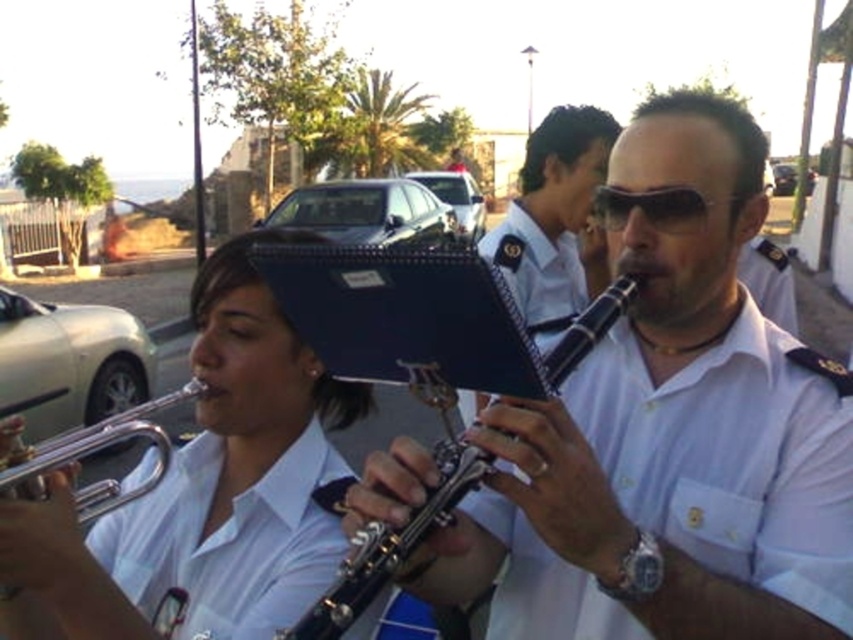
You are a photographer trying to capture the musician in the white cotton shirt at center. Based on the coordinates provided in the Objects Description, where should you position your camera to ensure the shirt is in the frame?

The white cotton shirt at center is located at point [730,456], so you should position your camera to focus on that coordinate to include the shirt in the frame.

You are a photographer trying to capture a closeup of the sunglasses at center. However, the white cotton shirt at left is blocking your view. Can you estimate if the shirt is large enough to completely cover the sunglasses when viewed from your current angle?

The white cotton shirt at left is larger in size than sunglasses at center, so it is possible that the shirt could completely cover the sunglasses when viewed from your current angle.